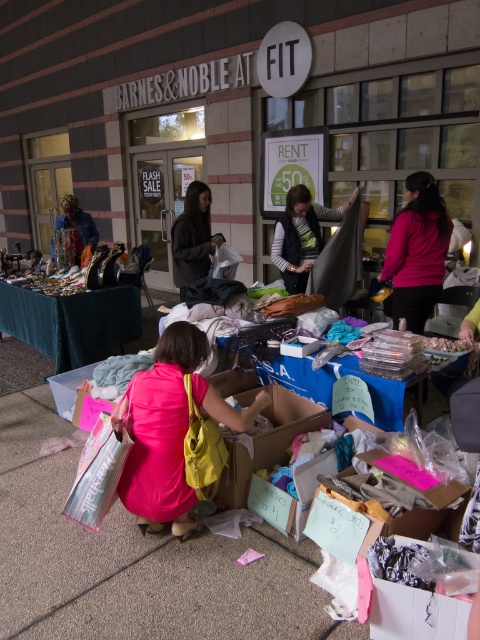
Question: Can you confirm if pink fabric dress at center is wider than pink fabric at center?

Choices:
 (A) yes
 (B) no

Answer: (A)

Question: In this image, where is pink fabric at center located relative to dark brown hair at center?

Choices:
 (A) below
 (B) above

Answer: (A)

Question: Which object is the farthest from the pink fabric dress at center?

Choices:
 (A) velvet green scarf at center
 (B) pink fabric at center
 (C) dark brown hair at center

Answer: (A)

Question: Does pink fabric at center appear on the right side of dark brown hair at center?

Choices:
 (A) yes
 (B) no

Answer: (A)

Question: Which object is the closest to the velvet green scarf at center?

Choices:
 (A) pink fabric dress at center
 (B) dark brown hair at center

Answer: (B)

Question: Which point appears closest to the camera in this image?

Choices:
 (A) (178, 225)
 (B) (143, 426)

Answer: (B)